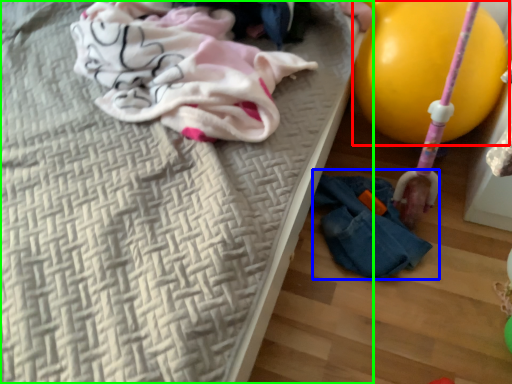
Question: Which object is positioned closest to balloon (highlighted by a red box)? Select from woman (highlighted by a blue box) and bed (highlighted by a green box).

Choices:
 (A) woman
 (B) bed

Answer: (A)